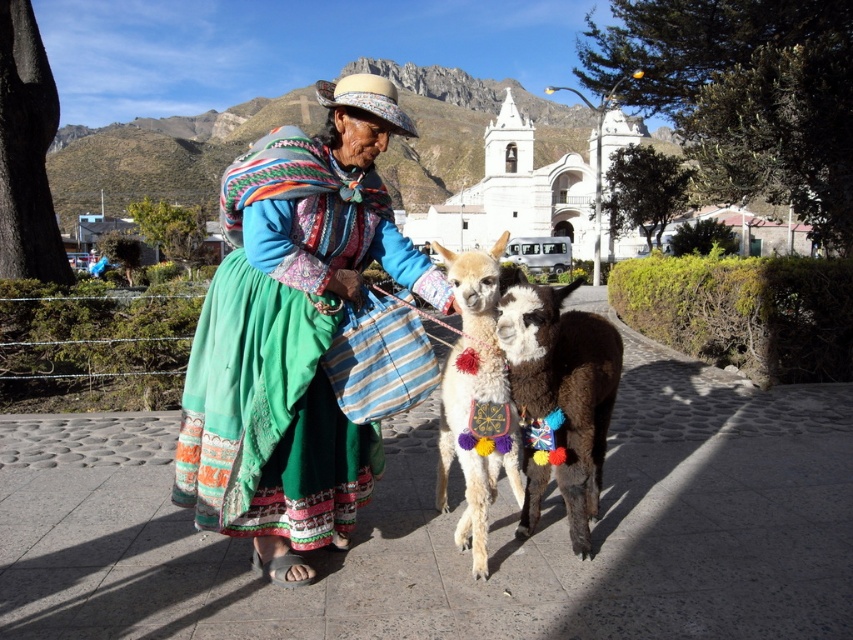
You are a photographer aiming to capture the woman and the alpaca in the scene. Since the matte green skirt at center and fluffy white alpaca at center are both at the center, which one should you focus on to ensure the subject is prominent in the photo?

The matte green skirt at center is larger in size than the fluffy white alpaca at center, so focusing on the matte green skirt at center will make the subject more prominent in the photo.

You are a photographer trying to capture a photo of both the soft brown woolen camel at center and the fluffy white alpaca at center. Since you want both animals to be clearly visible in the photo, which one should you focus on first to ensure proper focus?

The soft brown woolen camel at center is shorter than the fluffy white alpaca at center. To ensure both are in focus, you should focus on the fluffy white alpaca at center first as it is taller, allowing the depth of field to cover the shorter camel.